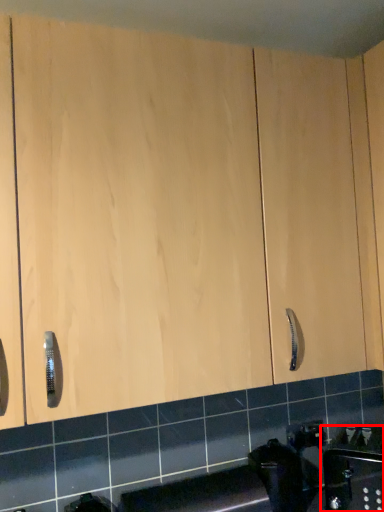
Question: Observing the image, what is the correct spatial positioning of sink (annotated by the red box) in reference to appliance?

Choices:
 (A) left
 (B) right

Answer: (B)